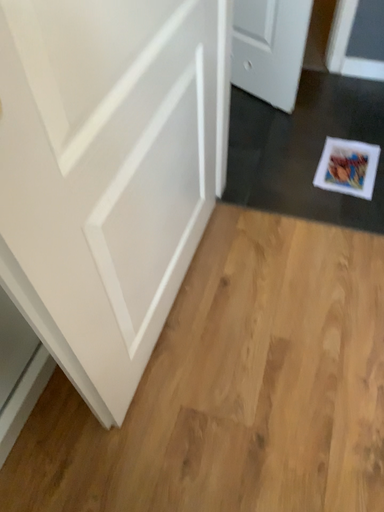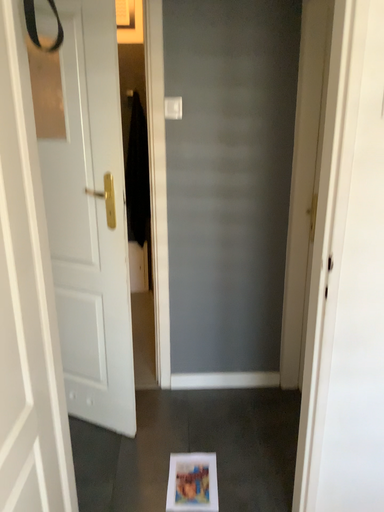
Question: Which way did the camera rotate in the video?

Choices:
 (A) rotated right
 (B) rotated left

Answer: (A)